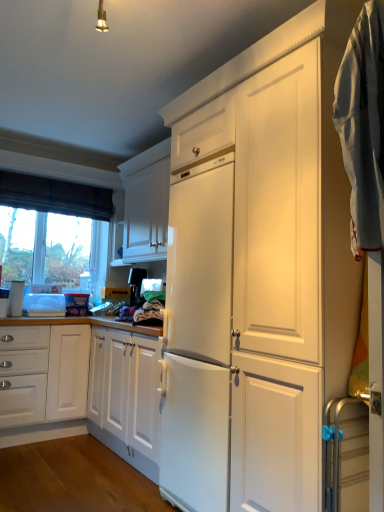
Question: Can you confirm if light blue cotton towel at right is taller than transparent glass window at left?

Choices:
 (A) yes
 (B) no

Answer: (A)

Question: From a real-world perspective, is light blue cotton towel at right beneath transparent glass window at left?

Choices:
 (A) yes
 (B) no

Answer: (B)

Question: Does light blue cotton towel at right have a greater width compared to transparent glass window at left?

Choices:
 (A) no
 (B) yes

Answer: (B)

Question: Does light blue cotton towel at right have a lesser width compared to transparent glass window at left?

Choices:
 (A) yes
 (B) no

Answer: (B)

Question: From the image's perspective, is light blue cotton towel at right on top of transparent glass window at left?

Choices:
 (A) no
 (B) yes

Answer: (B)

Question: From a real-world perspective, is light blue cotton towel at right on top of transparent glass window at left?

Choices:
 (A) yes
 (B) no

Answer: (A)

Question: Is metallic silver towel rack at right, the 2th appliance positioned from the top, at the back of light blue cotton towel at right?

Choices:
 (A) yes
 (B) no

Answer: (B)

Question: From a real-world perspective, does light blue cotton towel at right sit lower than metallic silver towel rack at right, positioned as the 2th appliance in left-to-right order?

Choices:
 (A) yes
 (B) no

Answer: (B)

Question: Does light blue cotton towel at right have a smaller size compared to metallic silver towel rack at right, positioned as the first appliance in bottom-to-top order?

Choices:
 (A) yes
 (B) no

Answer: (B)

Question: Considering the relative sizes of light blue cotton towel at right and metallic silver towel rack at right, positioned as the first appliance in front-to-back order, in the image provided, is light blue cotton towel at right taller than metallic silver towel rack at right, positioned as the first appliance in front-to-back order,?

Choices:
 (A) yes
 (B) no

Answer: (A)

Question: From the image's perspective, is light blue cotton towel at right below metallic silver towel rack at right, positioned as the 2th appliance in left-to-right order?

Choices:
 (A) yes
 (B) no

Answer: (B)

Question: Considering the relative positions of light blue cotton towel at right and metallic silver towel rack at right, positioned as the first appliance in front-to-back order, in the image provided, is light blue cotton towel at right to the right of metallic silver towel rack at right, positioned as the first appliance in front-to-back order, from the viewer's perspective?

Choices:
 (A) yes
 (B) no

Answer: (A)

Question: Is white glossy cabinet at upper center wider than satin black coffee maker at center, the first appliance in the back-to-front sequence?

Choices:
 (A) yes
 (B) no

Answer: (A)